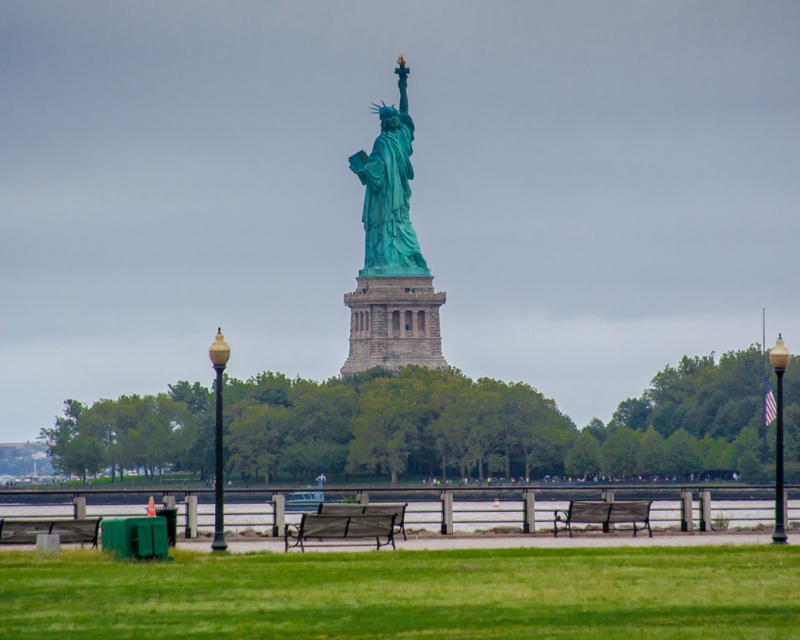
You are planning to take a photo of the green patina statue at center and the metallic green bench at center from a position where both are visible. Based on their widths, which object should you position closer to the camera to ensure both fit in the frame?

The green patina statue at center has a lesser width compared to the metallic green bench at center. To ensure both fit in the frame, position the metallic green bench at center closer to the camera since it is wider and requires more space in the photo.

You are planning to sit on the wooden park bench at center while also placing your bag on the gold polished lamp post at center. Considering their sizes, which object can accommodate your bag better?

The wooden park bench at center has a larger width than the gold polished lamp post at center, so it can accommodate your bag better.

You are standing at the railing in the grassy area and want to take a photo of the Statue of Liberty. Where should you position yourself to capture the clear water at lower center in your shot?

The clear water at lower center is located at point (486, 506) in the image, so you should position yourself at the railing near the lower center area to include it in your photo.